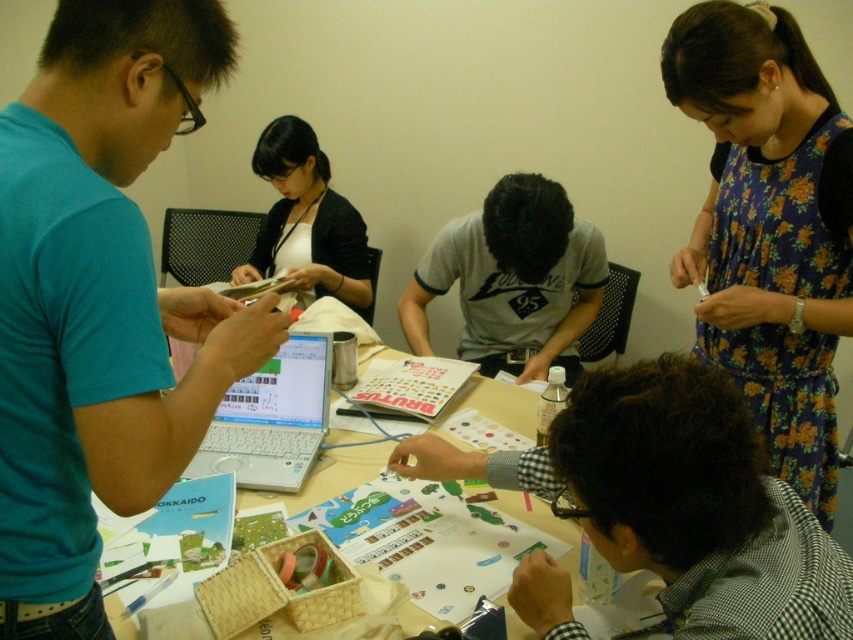
You are standing at the entrance of the room and want to find the floral dress at upper right. According to the coordinates provided, which direction should you look to locate it?

The floral dress at upper right is located at point (769, 227), which means it is positioned towards the upper right direction from your current position at the entrance.

You are organizing a small event and need to know if the floral dress at upper right can be placed on the table where the white plastic laptop at center is located without blocking the laptop. Can it fit?

The floral dress at upper right might be wider than the white plastic laptop at center, so there is a possibility it could block the laptop if placed on the same table space.